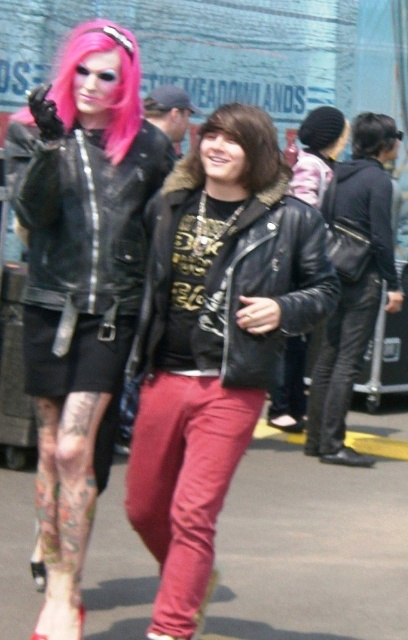
You are a photographer trying to capture a candid shot of the matte black leather jacket at center and the clear plastic goggles at upper left. Since you want both items in focus, you need to know their vertical positions. Which object is positioned higher in the frame?

The clear plastic goggles at upper left are positioned higher than the matte black leather jacket at center, so to capture both in focus, ensure your camera focuses on the clear plastic goggles at upper left first as they are higher up.

You are a photographer trying to capture a closeup of both the pink synthetic wig at upper left and the brownhair at center in the scene. Given that your camera can only focus on one object at a time, which object should you focus on first to ensure it appears sharp in the photo?

The pink synthetic wig at upper left should be focused on first because it has a larger size compared to the brownhair at center, making it more prominent and requiring proper focus.